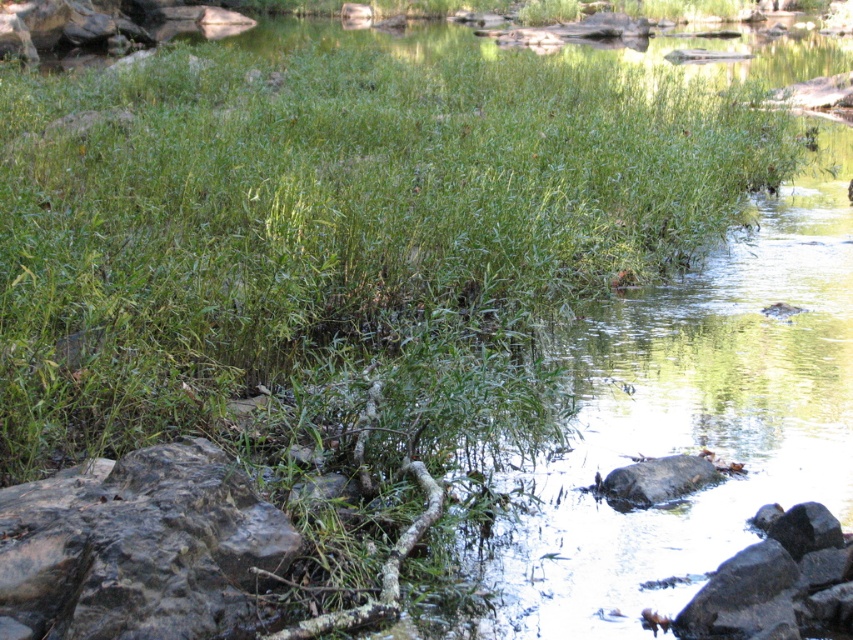
You are standing at the edge of the stream and want to take a photo of the gray rough rock at lower left. If your camera has a maximum focus range of 3 meters, will it be able to capture the rock clearly?

The gray rough rock at lower left and camera are 3.70 meters apart from each other. Since the camera can only focus up to 3 meters, it won cannot capture the rock clearly because it is beyond the maximum focus range.

You are standing at the edge of the stream and want to place a small item on the closest rock. Which rock should you choose between the gray rough rock at lower left and the smooth gray rock at lower right?

The gray rough rock at lower left is closer to the viewer, so you should place the item on the gray rough rock at lower left.

You are a frog sitting on the smooth gray rock at lower right and want to jump to the smooth gray rock at center. Can you see the rock you want to jump to from your current position?

The smooth gray rock at lower right is positioned under the smooth gray rock at center, so yes, the frog can see the rock it wants to jump to because it is directly above its current position.